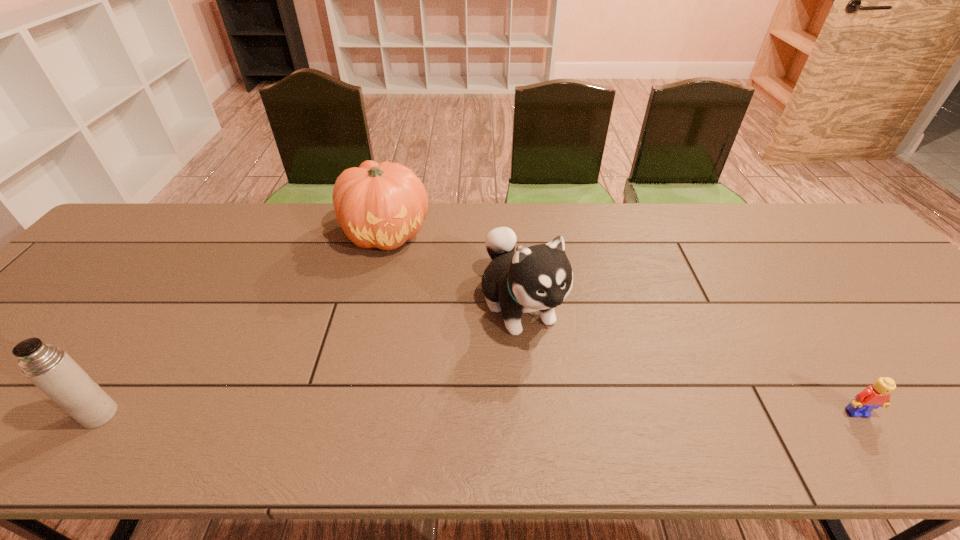
I want to click on free space between the third object from left to right and the farthest object, so click(453, 269).

Where is `vacant space in between the rightmost object and the second object from left to right`? This screenshot has width=960, height=540. vacant space in between the rightmost object and the second object from left to right is located at coordinates click(x=621, y=323).

Identify the location of free space between the third object from right to left and the puppy. (453, 269).

Where is `free space between the thermos bottle and the rightmost object`? Image resolution: width=960 pixels, height=540 pixels. free space between the thermos bottle and the rightmost object is located at coordinates (478, 413).

Identify the location of free space between the thermos bottle and the farthest object. (243, 324).

Where is `free space that is in between the shortest object and the second farthest object`? free space that is in between the shortest object and the second farthest object is located at coordinates (688, 359).

You are a GUI agent. You are given a task and a screenshot of the screen. Output one action in this format:
    pyautogui.click(x=<x>, y=<y>)
    Task: Click on the vacant point located between the puppy and the rightmost object
    The width and height of the screenshot is (960, 540).
    Given the screenshot: What is the action you would take?
    pyautogui.click(x=688, y=359)

Where is `free spot between the third object from right to left and the shortest object`? This screenshot has height=540, width=960. free spot between the third object from right to left and the shortest object is located at coordinates (621, 323).

At what (x,y) coordinates should I click in order to perform the action: click on unoccupied position between the rightmost object and the farthest object. Please return your answer as a coordinate pair (x, y). The width and height of the screenshot is (960, 540). Looking at the image, I should click on click(621, 323).

The height and width of the screenshot is (540, 960). I want to click on vacant region between the pumpkin and the second object from right to left, so click(x=453, y=269).